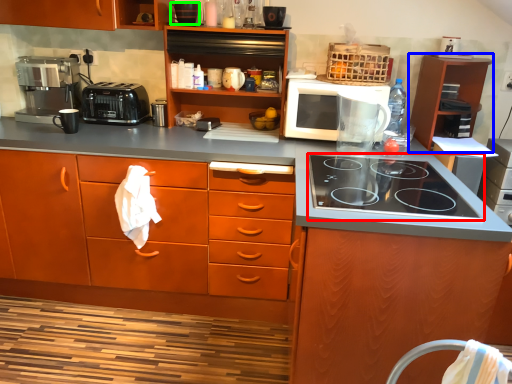
Question: Which is farther away from gas stove (highlighted by a red box)? cabinetry (highlighted by a blue box) or appliance (highlighted by a green box)?

Choices:
 (A) cabinetry
 (B) appliance

Answer: (B)